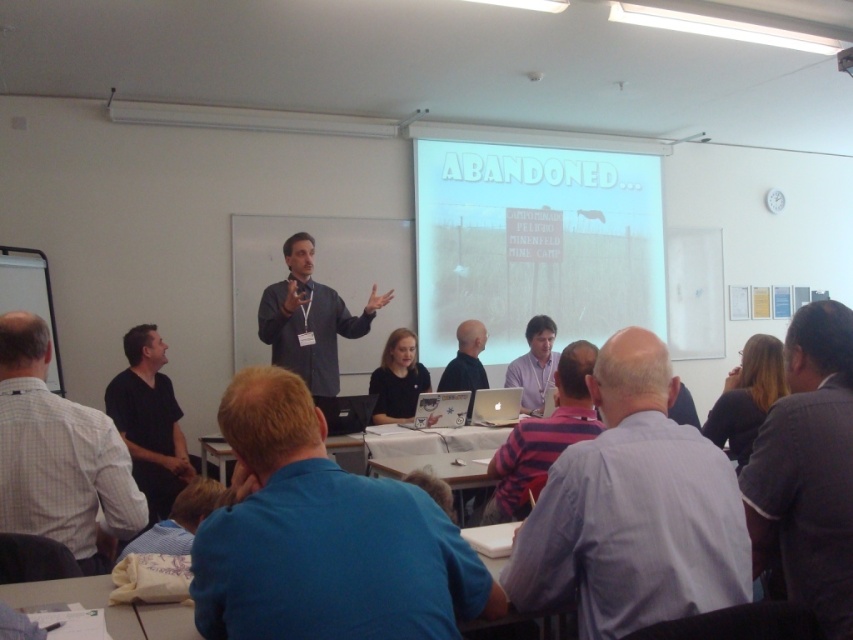
Question: Is gray striped shirt at center positioned before striped fabric shirt at center?

Choices:
 (A) yes
 (B) no

Answer: (A)

Question: Which object is the closest to the metallic projector at upper center?

Choices:
 (A) black matte shirt at lower left
 (B) blue shirt at lower center
 (C) black matte shirt at center

Answer: (C)

Question: Which of the following is the closest to the observer?

Choices:
 (A) matte gray shirt at center
 (B) black matte shirt at lower left
 (C) black matte shirt at center

Answer: (A)

Question: Is blue fabric shirt at center closer to the viewer compared to striped fabric shirt at center?

Choices:
 (A) yes
 (B) no

Answer: (A)

Question: Is gray striped shirt at center bigger than metallic projector at upper center?

Choices:
 (A) no
 (B) yes

Answer: (B)

Question: Which point is farther to the camera?

Choices:
 (A) striped fabric shirt at center
 (B) black matte shirt at lower left
 (C) white shirt at lower left
 (D) gray striped shirt at center

Answer: (B)